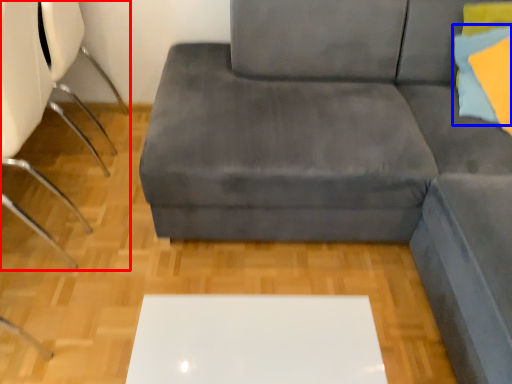
Question: Which object is closer to the camera taking this photo, chair (highlighted by a red box) or pillow (highlighted by a blue box)?

Choices:
 (A) chair
 (B) pillow

Answer: (A)